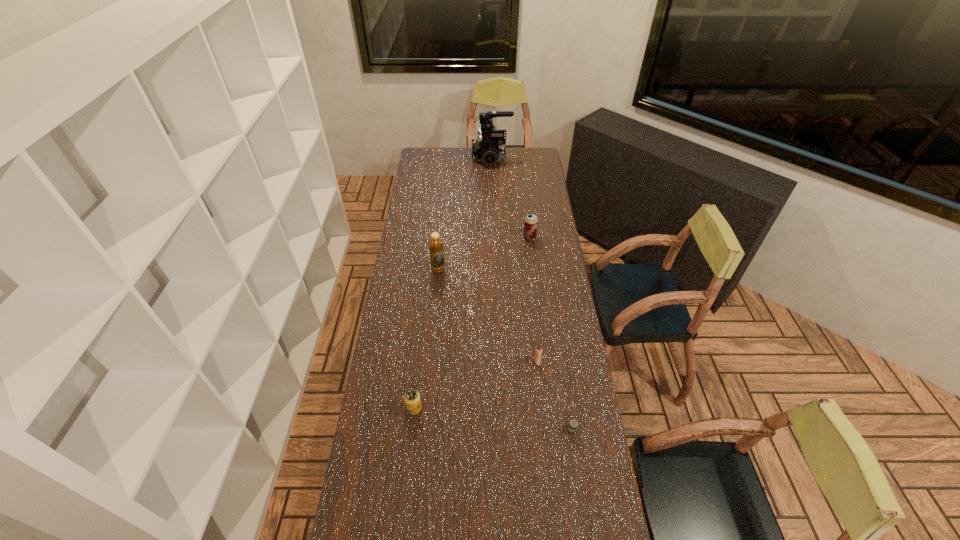
At what (x,y) coordinates should I click in order to perform the action: click on vacant space located on the lens mount of the tallest object. Please return your answer as a coordinate pair (x, y). Looking at the image, I should click on pyautogui.click(x=450, y=157).

The height and width of the screenshot is (540, 960). Identify the location of blank space located 0.300m on the lens mount of the tallest object. (421, 157).

Identify the location of vacant space positioned on the front of the second tallest object. (437, 286).

Identify the location of vacant space located on the back of the third tallest object. Image resolution: width=960 pixels, height=540 pixels. (526, 208).

Find the location of a particular element. The image size is (960, 540). blank area located on the front of the second shortest beer can is located at coordinates (409, 456).

Image resolution: width=960 pixels, height=540 pixels. What are the coordinates of `free space located 0.310m on the back of the igniter` in the screenshot? It's located at (530, 296).

Where is `blank area located 0.050m on the front of the shortest object`? This screenshot has width=960, height=540. blank area located 0.050m on the front of the shortest object is located at coordinates (577, 462).

Where is `object that is at the far edge`? Image resolution: width=960 pixels, height=540 pixels. object that is at the far edge is located at coordinates (489, 148).

The width and height of the screenshot is (960, 540). I want to click on bottle that is positioned at the left edge, so click(435, 243).

Identify the location of beer can located in the left edge section of the desktop. (412, 400).